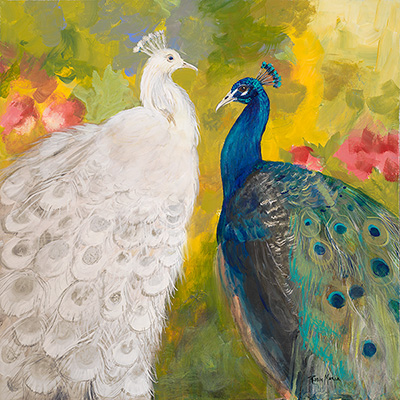
Identify the location of red paint. Image resolution: width=400 pixels, height=400 pixels. (15, 110), (68, 115), (38, 78), (300, 154), (353, 152), (389, 149).